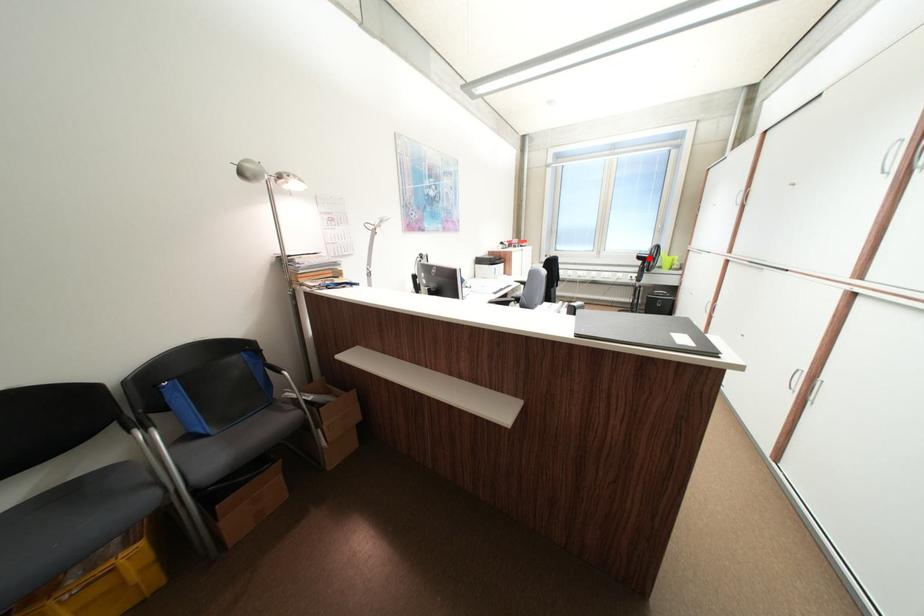
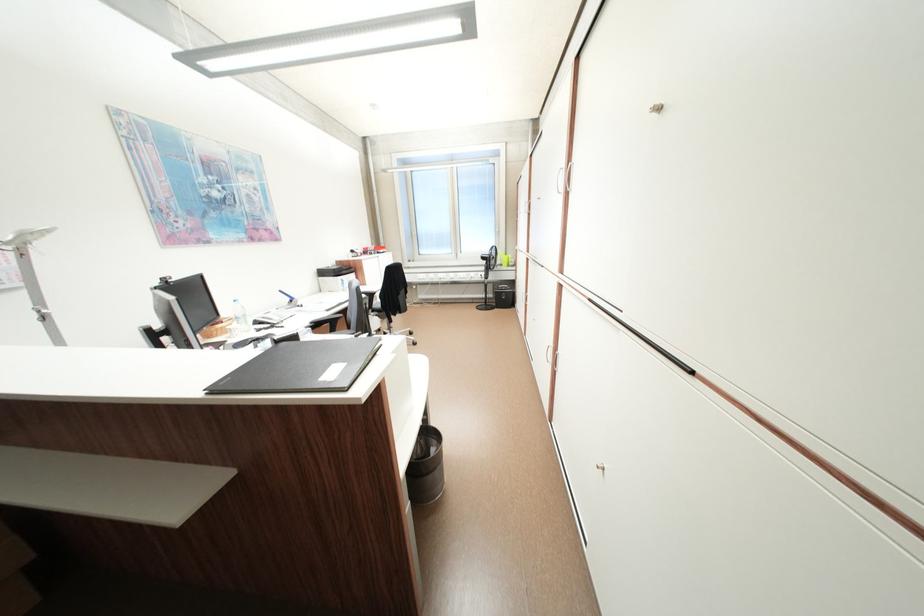
The point at the highlighted location is marked in the first image. Where is the corresponding point in the second image?

(492, 259)